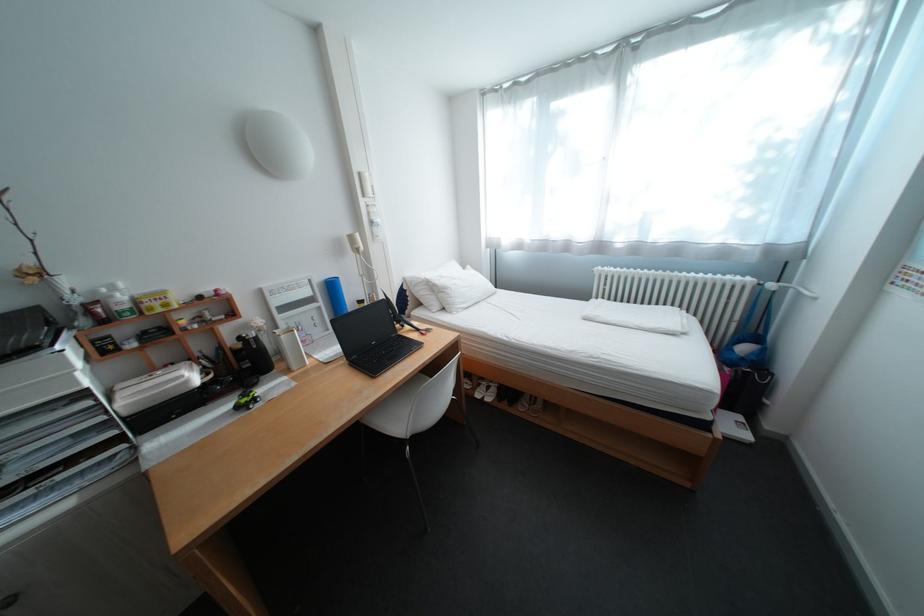
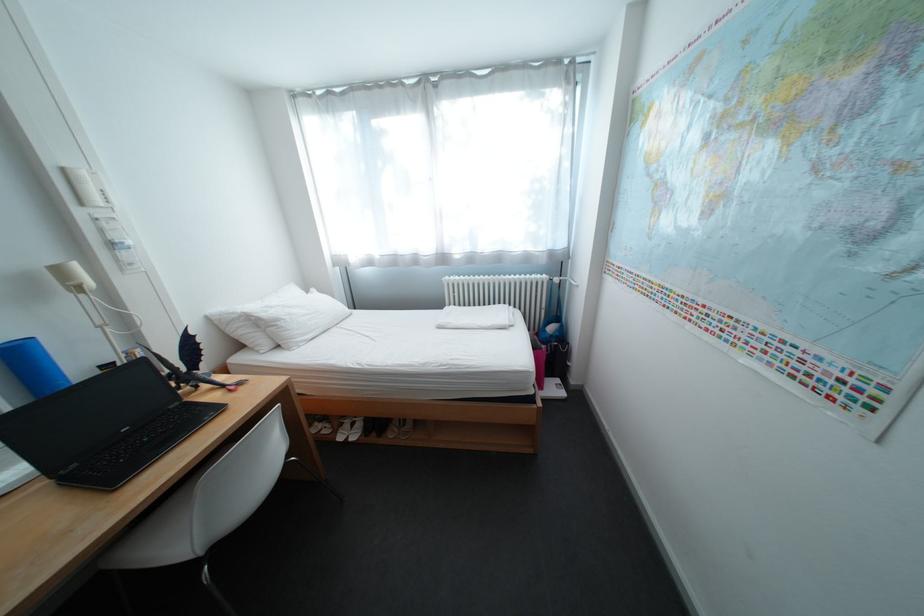
Find the pixel in the second image that matches (342,282) in the first image.

(17, 347)